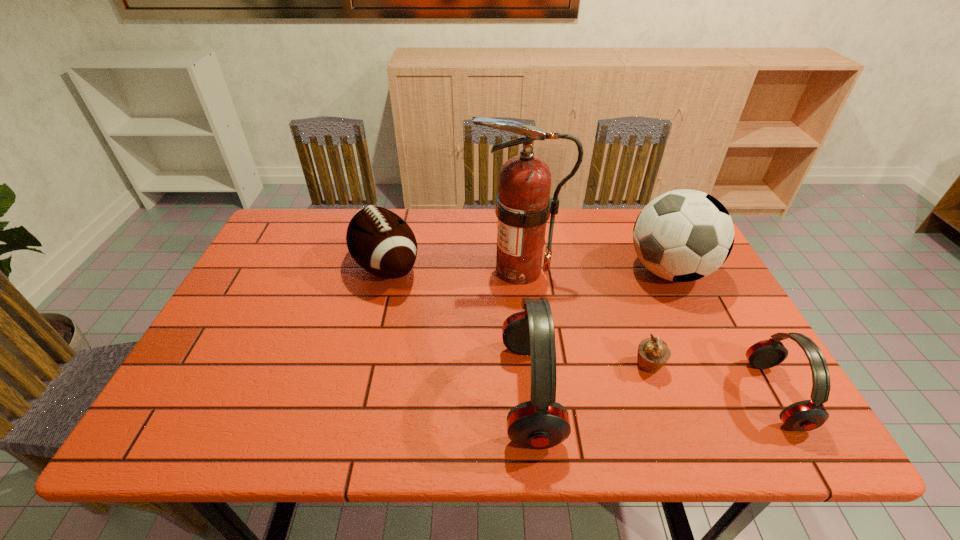
Find the location of a particular element. The height and width of the screenshot is (540, 960). the taller earphone is located at coordinates (541, 423).

Locate an element on the screen. This screenshot has height=540, width=960. the right earphone is located at coordinates (807, 415).

What are the coordinates of `soccer ball` in the screenshot? It's located at (683, 235).

The image size is (960, 540). What are the coordinates of `fire extinguisher` in the screenshot? It's located at (523, 205).

This screenshot has width=960, height=540. In order to click on the leftmost object in this screenshot , I will do click(x=381, y=242).

Image resolution: width=960 pixels, height=540 pixels. Find the location of `muffin`. muffin is located at coordinates (x=653, y=353).

Find the location of `vacant space located 0.140m on the ear cups of the left earphone`. vacant space located 0.140m on the ear cups of the left earphone is located at coordinates (439, 392).

The height and width of the screenshot is (540, 960). I want to click on vacant space located 0.290m on the ear cups of the left earphone, so click(x=371, y=392).

Locate an element on the screen. Image resolution: width=960 pixels, height=540 pixels. vacant space located on the ear cups of the left earphone is located at coordinates (379, 392).

The width and height of the screenshot is (960, 540). Find the location of `vacant space located on the ear cups of the right earphone`. vacant space located on the ear cups of the right earphone is located at coordinates (587, 395).